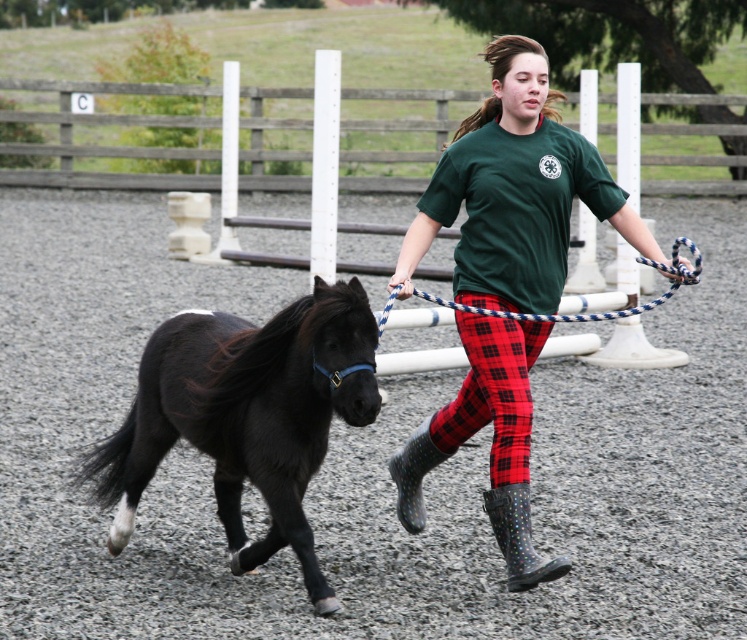
You are standing at the point marked as point (365,460) in the image. What type of surface are you standing on?

The point (365,460) is on gray gravel dirt track at center, so you are standing on a gray gravel dirt track.

You are a photographer trying to capture a clear shot of both the rubber dotted boot at lower center and the blue and white rope at center. Based on their positions, which object should you focus on first to ensure both are in focus?

You should focus on the rubber dotted boot at lower center first because it is closer to the viewer than the blue and white rope at center, so adjusting focus from near to far will help both objects be in focus.

You are a photographer wanting to capture the black glossy horse at left and the gray gravel dirt track at center in your shot. Which object is positioned to the right of the other?

The gray gravel dirt track at center is to the right of the black glossy horse at left.